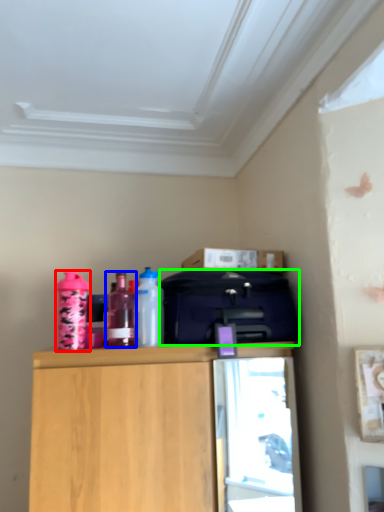
Question: Which object is positioned closest to bottle (highlighted by a red box)? Select from bottle (highlighted by a blue box) and luggage (highlighted by a green box).

Choices:
 (A) bottle
 (B) luggage

Answer: (A)